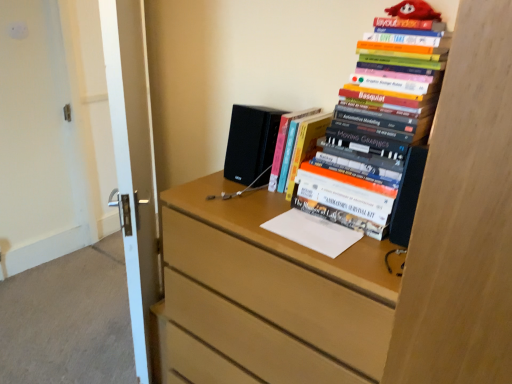
This screenshot has height=384, width=512. In order to click on vacant space that is to the left of hardcover books at upper right, the 1th book from the right in this screenshot , I will do `click(247, 205)`.